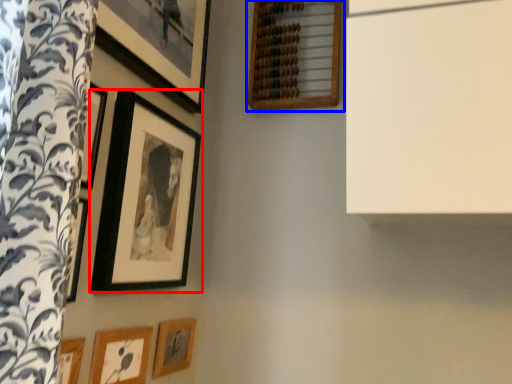
Question: Which of the following is the farthest to the observer, picture frame (highlighted by a red box) or picture frame (highlighted by a blue box)?

Choices:
 (A) picture frame
 (B) picture frame

Answer: (B)